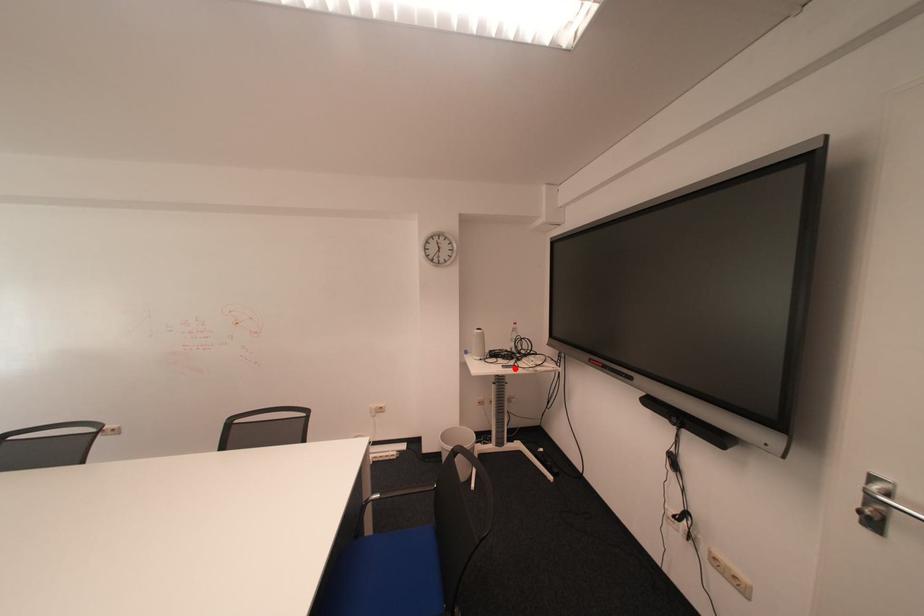
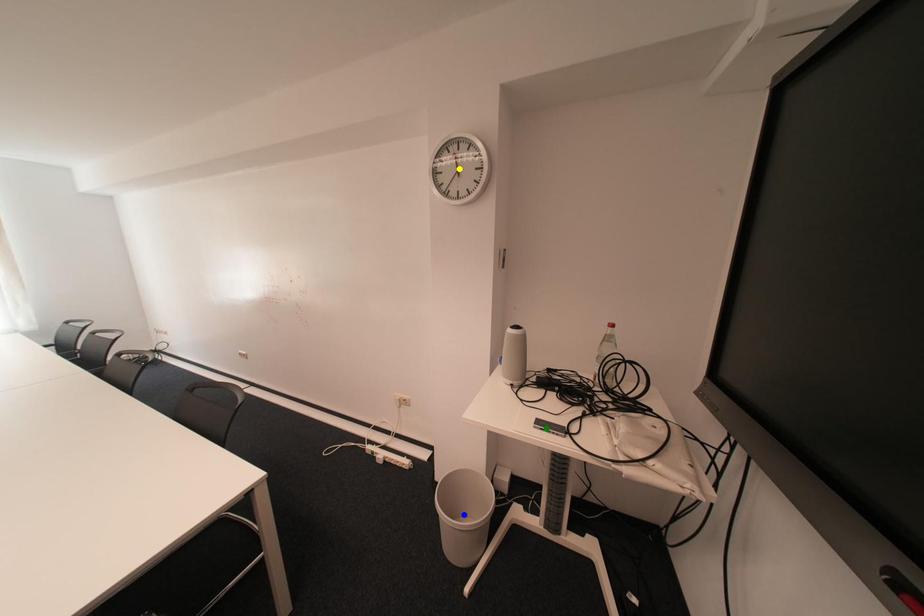
Question: I am providing you with two images of the same scene from different viewpoints. A red point is marked on the first image. You are given multiple points on the second image. Which point in image 2 represents the same 3d spot as the red point in image 1?

Choices:
 (A) yellow point
 (B) blue point
 (C) green point

Answer: (C)